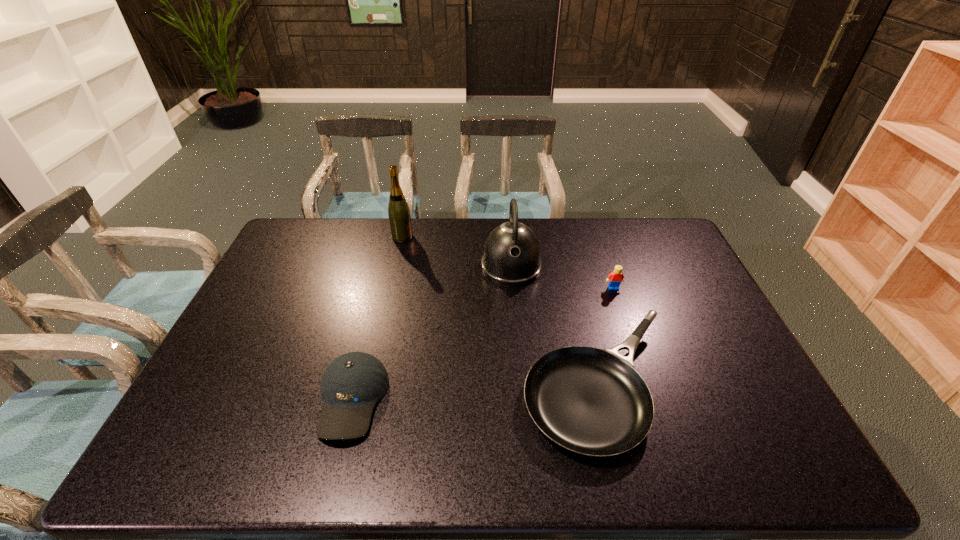
You are a GUI agent. You are given a task and a screenshot of the screen. Output one action in this format:
    pyautogui.click(x=<x>, y=<y>)
    Task: Click on the wine bottle
    
    Given the screenshot: What is the action you would take?
    pyautogui.click(x=399, y=215)

Locate an element on the screen. The image size is (960, 540). kettle is located at coordinates (512, 255).

Find the location of `Lego`. Lego is located at coordinates (615, 278).

The height and width of the screenshot is (540, 960). I want to click on baseball cap, so click(x=352, y=384).

Find the location of a particular element. This screenshot has width=960, height=540. pan is located at coordinates (591, 401).

At what (x,y) coordinates should I click in order to perform the action: click on vacant space located on the front-facing side of the wine bottle. Please return your answer as a coordinate pair (x, y). Looking at the image, I should click on (492, 237).

I want to click on free space located on the spout of the kettle, so click(x=518, y=349).

Where is `free space located on the face of the Lego`? The height and width of the screenshot is (540, 960). free space located on the face of the Lego is located at coordinates (618, 303).

Where is `blank space located on the front-facing side of the baseball cap`? blank space located on the front-facing side of the baseball cap is located at coordinates (333, 472).

Identify the location of blank space located on the left of the pan. The width and height of the screenshot is (960, 540). (438, 386).